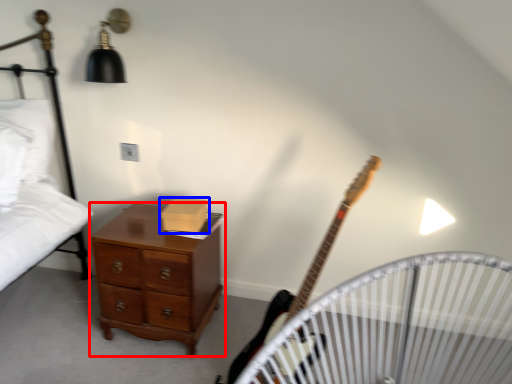
Question: Which object is closer to the camera taking this photo, chest of drawers (highlighted by a red box) or box (highlighted by a blue box)?

Choices:
 (A) chest of drawers
 (B) box

Answer: (A)